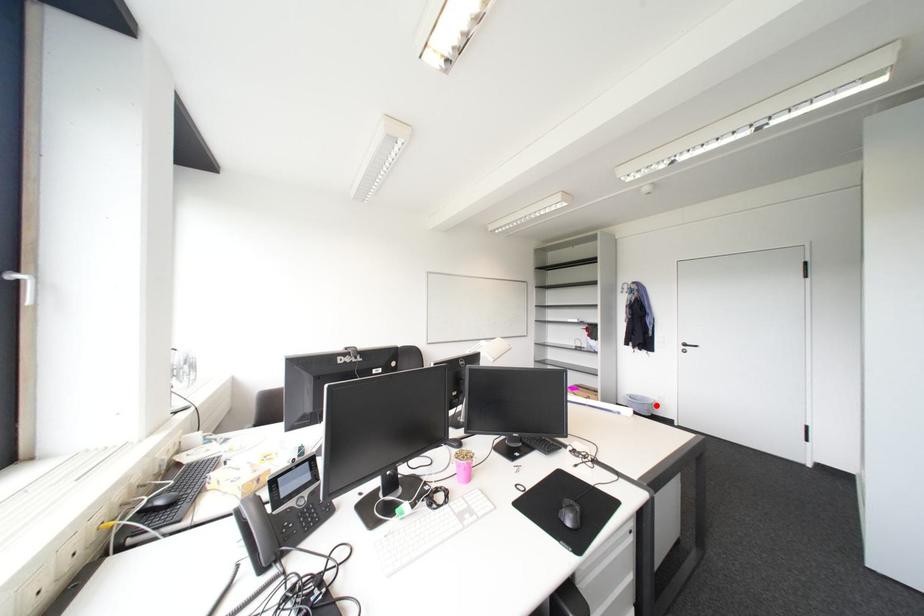
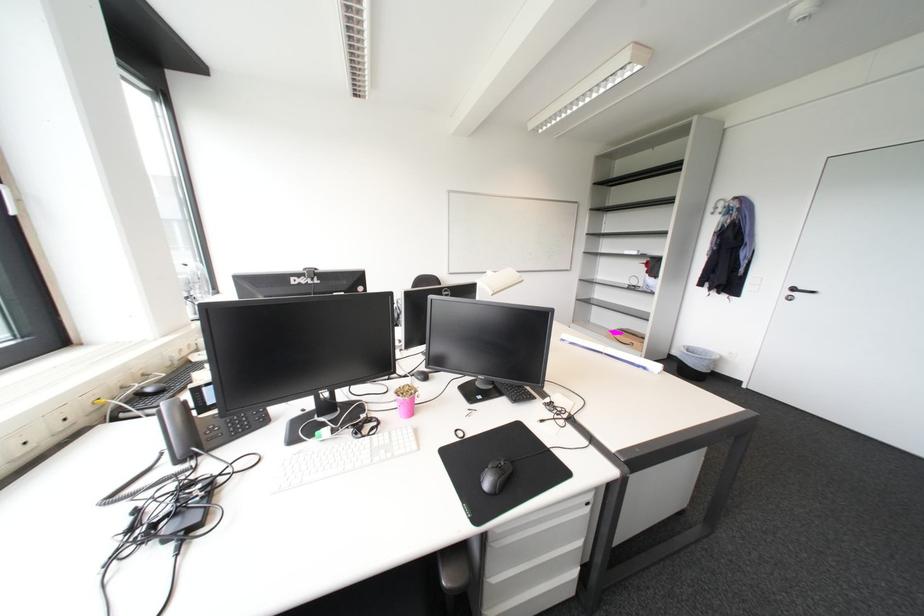
In the second image, find the point that corresponds to the highlighted location in the first image.

(716, 361)